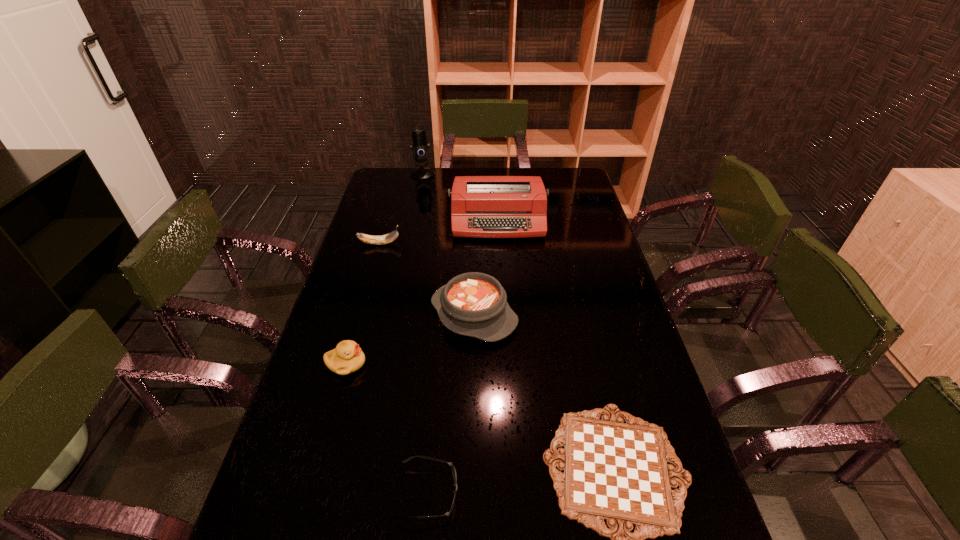
The width and height of the screenshot is (960, 540). What are the coordinates of `the tallest object` in the screenshot? It's located at (420, 146).

Identify the location of the farthest object. The width and height of the screenshot is (960, 540). (420, 146).

This screenshot has height=540, width=960. I want to click on the second tallest object, so click(481, 206).

Image resolution: width=960 pixels, height=540 pixels. Find the location of `casserole`. casserole is located at coordinates (474, 304).

Identify the location of banana. The image size is (960, 540). click(388, 238).

What are the coordinates of `the fifth farthest object` in the screenshot? It's located at (347, 357).

Locate an element on the screen. the second shortest object is located at coordinates 447,514.

The height and width of the screenshot is (540, 960). Identify the location of vacant space located 0.230m on the stand of the tallest object. (416, 208).

Locate an element on the screen. The image size is (960, 540). vacant space located on the typing side of the sixth shortest object is located at coordinates (500, 255).

Image resolution: width=960 pixels, height=540 pixels. Identify the location of free location located on the right of the fourth farthest object. (633, 314).